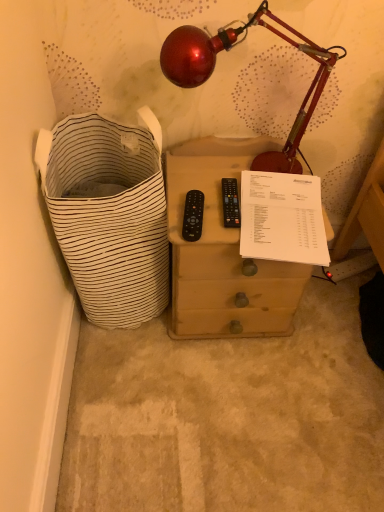
In order to click on vacant area that lies between black plastic remote at center, which ranks as the first control in right-to-left order, and black plastic remote at center, the 1th control viewed from the left in this screenshot , I will do `click(211, 213)`.